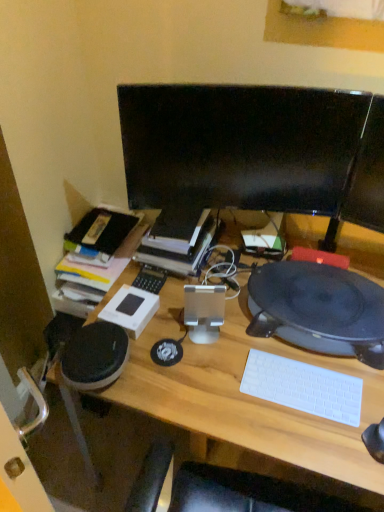
Where is `vacant space situated above black matte record player at right (from a real-world perspective)`? Image resolution: width=384 pixels, height=512 pixels. vacant space situated above black matte record player at right (from a real-world perspective) is located at coordinates (322, 295).